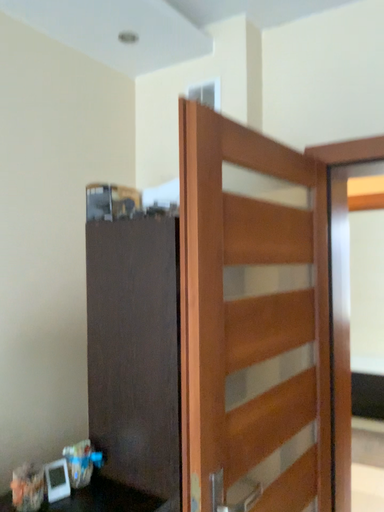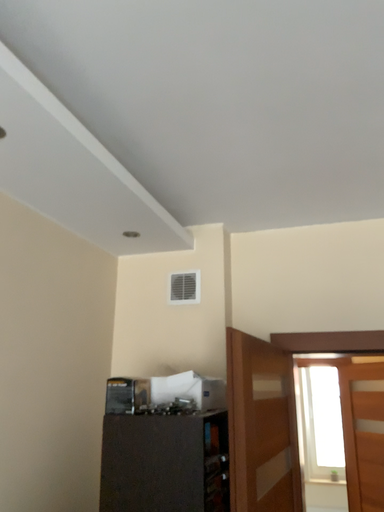
Question: How did the camera likely rotate when shooting the video?

Choices:
 (A) rotated upward
 (B) rotated downward

Answer: (A)